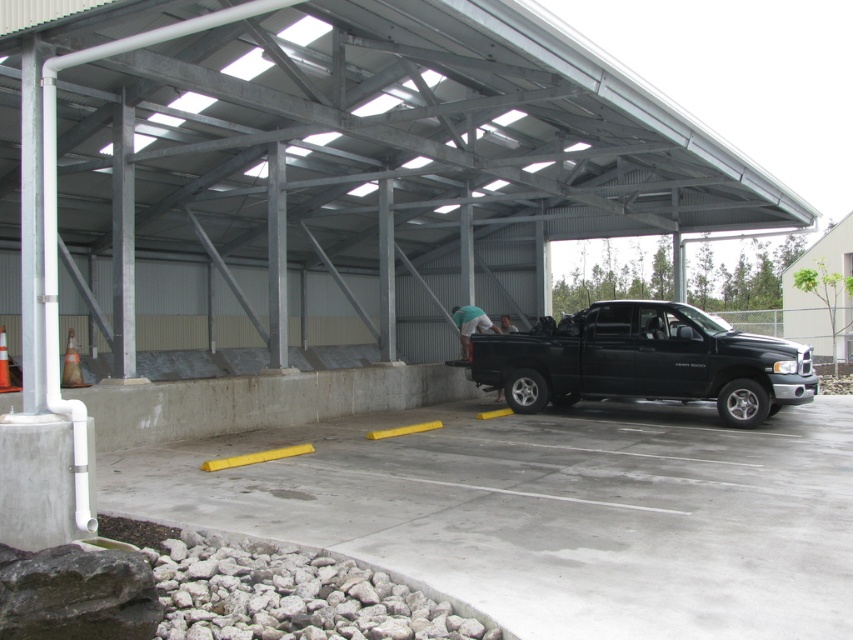
You are driving a delivery van that is 2 meters wide. You need to park your van in the shelter where the concrete at center and the black matte truck at center are located. Can your van fit between the two objects if you park it there?

The concrete at center might be wider than black matte truck at center, but since the exact width isn not provided, it is uncertain whether the van can fit. Please check the actual space before parking.

You are a delivery person who needs to unload a package from the black matte truck at center. The package is too heavy to carry, so you decide to roll it on the ground. Since the concrete at center is smoother than the surrounding ground, which direction should you roll the package to make it easier?

The concrete at center is positioned on the left side of black matte truck at center, so you should roll the package to the left to utilize the smoother surface for easier movement.